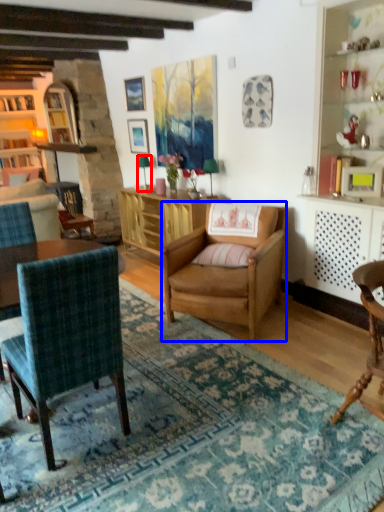
Question: Which of the following is the closest to the observer, lamp (highlighted by a red box) or chair (highlighted by a blue box)?

Choices:
 (A) lamp
 (B) chair

Answer: (B)